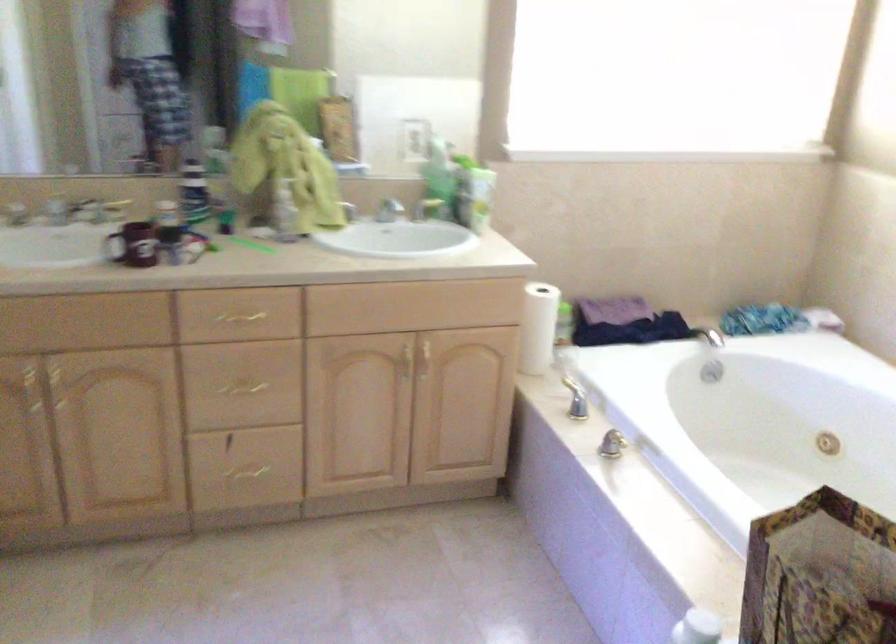
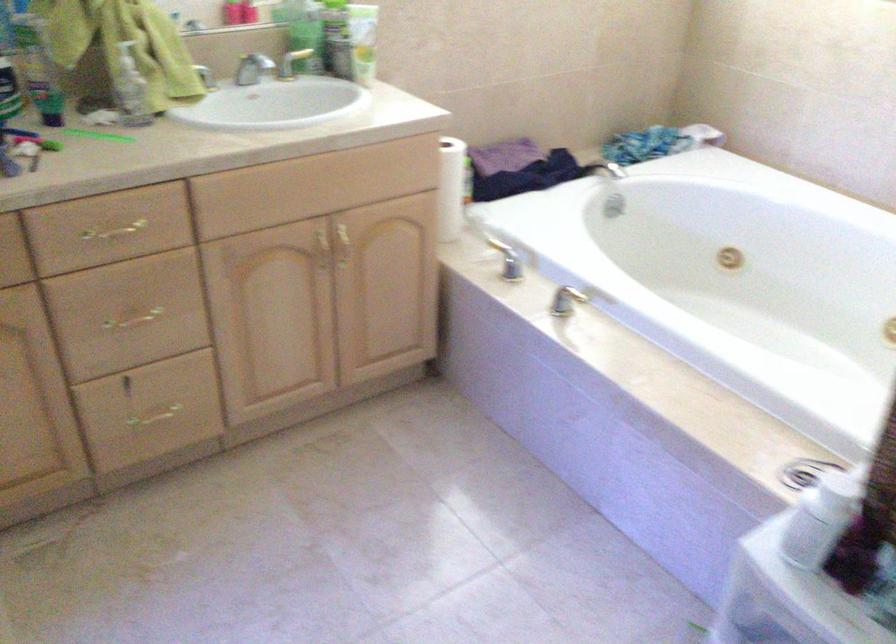
Locate, in the second image, the point that corresponds to point 543,326 in the first image.

(451, 187)